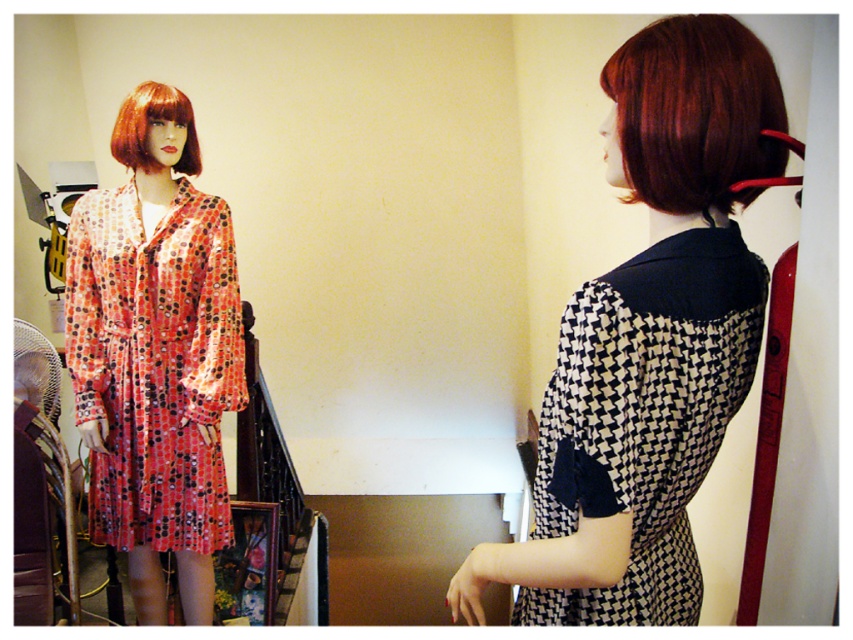
Can you confirm if shiny red hair at upper right is thinner than blonde synthetic wig at upper left?

Incorrect, shiny red hair at upper right's width is not less than blonde synthetic wig at upper left's.

Does shiny red hair at upper right appear over blonde synthetic wig at upper left?

No, shiny red hair at upper right is not above blonde synthetic wig at upper left.

Where is `shiny red hair at upper right`? This screenshot has height=640, width=853. shiny red hair at upper right is located at coordinates (695, 113).

Is black and white checkered dress at right above polka dot silk dress at left?

Yes, black and white checkered dress at right is above polka dot silk dress at left.

Consider the image. Is the position of black and white checkered dress at right less distant than that of polka dot silk dress at left?

Yes, black and white checkered dress at right is closer to the viewer.

You are a GUI agent. You are given a task and a screenshot of the screen. Output one action in this format:
    pyautogui.click(x=<x>, y=<y>)
    Task: Click on the black and white checkered dress at right
    Image resolution: width=853 pixels, height=640 pixels.
    Given the screenshot: What is the action you would take?
    pyautogui.click(x=648, y=340)

Is black and white checkered dress at center above shiny red hair at upper right?

Actually, black and white checkered dress at center is below shiny red hair at upper right.

Which is more to the right, black and white checkered dress at center or shiny red hair at upper right?

shiny red hair at upper right

Between point (700, 596) and point (776, 100), which one is positioned behind?

The point (700, 596) is more distant.

Identify the location of black and white checkered dress at center. (643, 417).